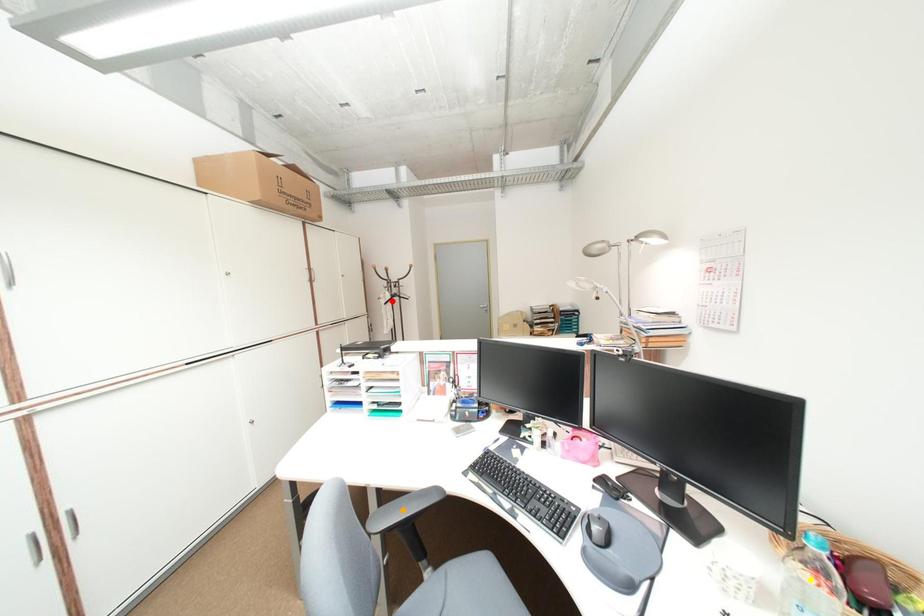
Order these from nearest to farthest:
- yellow point
- red point
- orange point

yellow point < orange point < red point